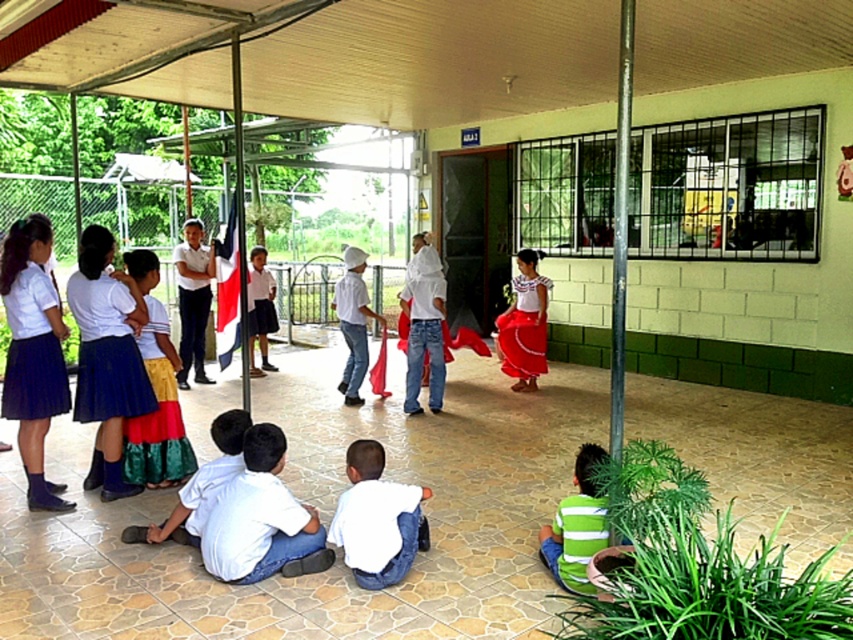
Can you confirm if shiny satin skirt at left is positioned to the right of white matte shirt at center?

No, shiny satin skirt at left is not to the right of white matte shirt at center.

Who is positioned more to the left, shiny satin skirt at left or white matte shirt at center?

Positioned to the left is shiny satin skirt at left.

At what (x,y) coordinates should I click in order to perform the action: click on shiny satin skirt at left. Please return your answer as a coordinate pair (x, y). This screenshot has width=853, height=640. Looking at the image, I should click on (155, 394).

Where is `shiny satin skirt at left`? shiny satin skirt at left is located at coordinates (155, 394).

What do you see at coordinates (155, 394) in the screenshot? I see `shiny satin skirt at left` at bounding box center [155, 394].

Between shiny satin skirt at left and white cotton shirt at center, which one is positioned higher?

white cotton shirt at center

Which is in front, point (166, 316) or point (253, 355)?

Positioned in front is point (166, 316).

Identify the location of shiny satin skirt at left. The width and height of the screenshot is (853, 640). click(155, 394).

Is metallic corrugated roof at upper center to the left of blue pleated skirt at left from the viewer's perspective?

Incorrect, metallic corrugated roof at upper center is not on the left side of blue pleated skirt at left.

Looking at this image, can you confirm if metallic corrugated roof at upper center is bigger than blue pleated skirt at left?

Correct, metallic corrugated roof at upper center is larger in size than blue pleated skirt at left.

Between point (511, 28) and point (61, 358), which one is positioned in front?

Point (61, 358) is more forward.

Image resolution: width=853 pixels, height=640 pixels. I want to click on metallic corrugated roof at upper center, so click(x=322, y=54).